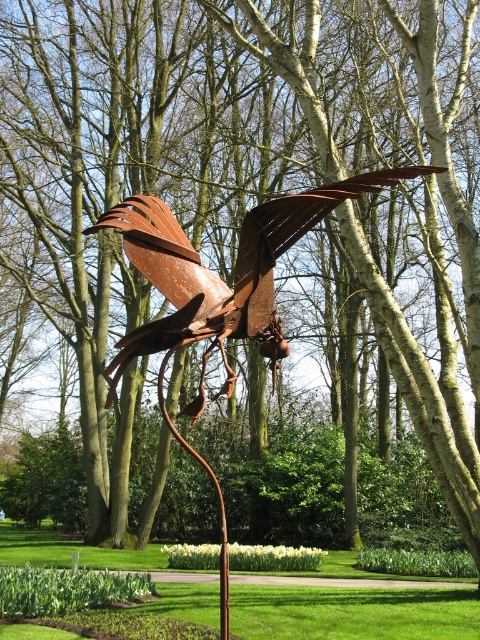
Question: Is rusty metal bird at center smaller than rusty metal sculpture at center?

Choices:
 (A) no
 (B) yes

Answer: (B)

Question: Which object appears closest to the camera in this image?

Choices:
 (A) rusty metal sculpture at center
 (B) rusty metal bird at center

Answer: (B)

Question: Can you confirm if rusty metal bird at center is bigger than rusty metal sculpture at center?

Choices:
 (A) yes
 (B) no

Answer: (B)

Question: Is rusty metal bird at center below rusty metal sculpture at center?

Choices:
 (A) no
 (B) yes

Answer: (A)

Question: Which point is closer to the camera?

Choices:
 (A) rusty metal sculpture at center
 (B) rusty metal bird at center

Answer: (B)